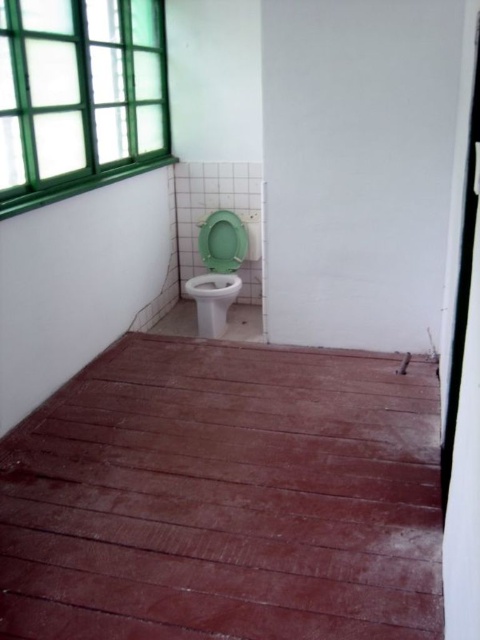
Question: Is green glass window at upper left smaller than green plastic toilet bowl at center?

Choices:
 (A) yes
 (B) no

Answer: (B)

Question: Does green glass window at upper left have a greater width compared to green plastic toilet bowl at center?

Choices:
 (A) no
 (B) yes

Answer: (B)

Question: Does green glass window at upper left appear on the left side of green plastic toilet bowl at center?

Choices:
 (A) no
 (B) yes

Answer: (B)

Question: Which object appears closest to the camera in this image?

Choices:
 (A) green plastic toilet bowl at center
 (B) green glass window at upper left

Answer: (B)

Question: Which object is farther from the camera taking this photo?

Choices:
 (A) green plastic toilet bowl at center
 (B) green glass window at upper left

Answer: (A)